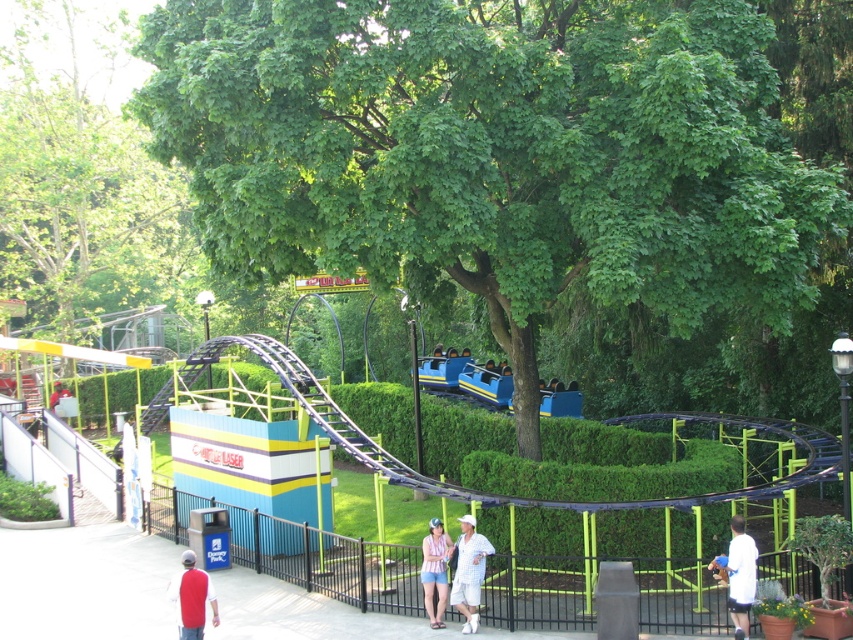
Between green leafy tree at center and striped cotton shirt at center, which one is positioned higher?

green leafy tree at center is higher up.

Between point (488, 304) and point (440, 576), which one is positioned behind?

Point (488, 304)

Is point (412, 152) farther from viewer compared to point (434, 518)?

No, (412, 152) is closer to viewer.

Where is `green leafy tree at center`? green leafy tree at center is located at coordinates 492,150.

Can you confirm if striped cotton shirt at center is shorter than matte white shirt at lower left?

Incorrect, striped cotton shirt at center's height does not fall short of matte white shirt at lower left's.

What are the coordinates of `striped cotton shirt at center` in the screenshot? It's located at (434, 570).

Is white cotton shirt at lower right to the left of striped cotton shirt at center from the viewer's perspective?

No, white cotton shirt at lower right is not to the left of striped cotton shirt at center.

Is point (743, 632) closer to viewer compared to point (433, 620)?

Yes, it is.

Which is behind, point (749, 589) or point (427, 573)?

The point (427, 573) is more distant.

The image size is (853, 640). Find the location of `white cotton shirt at lower right`. white cotton shirt at lower right is located at coordinates (740, 576).